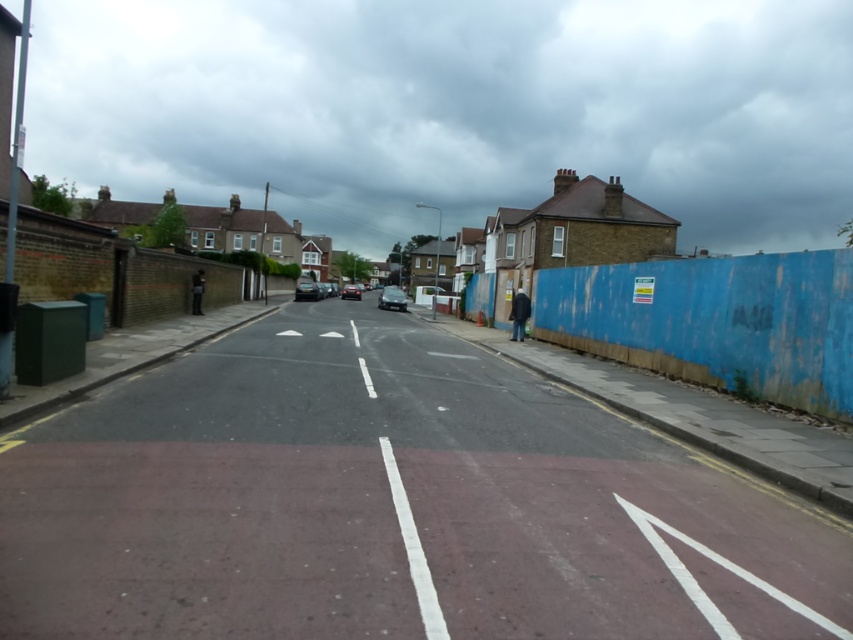
Question: Which point appears farthest from the camera in this image?

Choices:
 (A) (392, 305)
 (B) (312, 294)

Answer: (B)

Question: Which object is the farthest from the metallic gray car at center?

Choices:
 (A) shiny black car at center
 (B) matte black car at center

Answer: (A)

Question: Among these points, which one is nearest to the camera?

Choices:
 (A) (349, 284)
 (B) (405, 305)
 (C) (302, 296)

Answer: (B)

Question: Can you confirm if metallic gray car at center is positioned to the left of shiny black car at center?

Choices:
 (A) yes
 (B) no

Answer: (B)

Question: Is metallic gray car at center to the left of matte black car at center from the viewer's perspective?

Choices:
 (A) no
 (B) yes

Answer: (A)

Question: Can you confirm if metallic gray car at center is thinner than shiny black car at center?

Choices:
 (A) no
 (B) yes

Answer: (A)